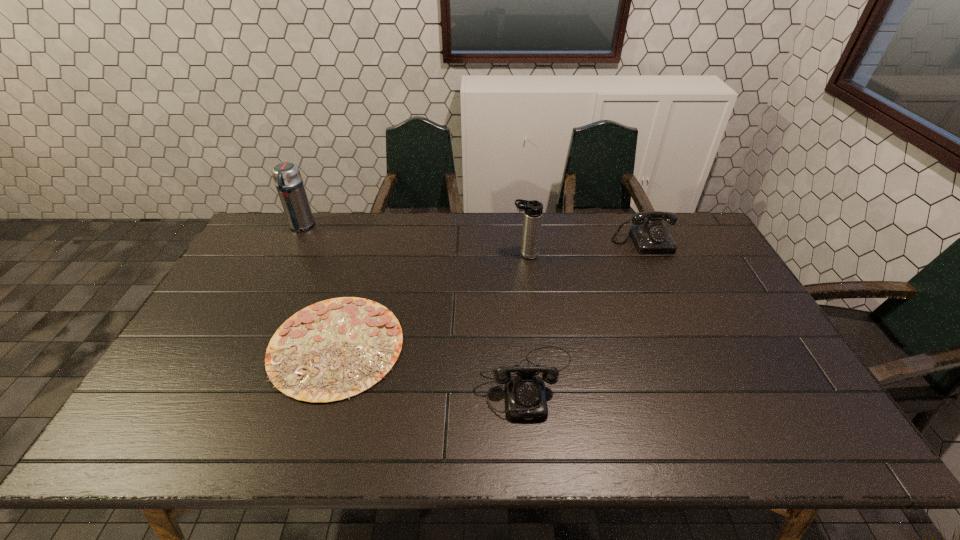
Where is `blank space located on the handle side of the right thermos bottle`? The width and height of the screenshot is (960, 540). blank space located on the handle side of the right thermos bottle is located at coordinates (488, 254).

You are a GUI agent. You are given a task and a screenshot of the screen. Output one action in this format:
    pyautogui.click(x=<x>, y=<y>)
    Task: Click on the vacant space located on the handle side of the right thermos bottle
    The height and width of the screenshot is (540, 960).
    Given the screenshot: What is the action you would take?
    pyautogui.click(x=401, y=254)

This screenshot has height=540, width=960. I want to click on vacant position located 0.370m on the dial of the rightmost object, so click(x=686, y=340).

Find the location of a particular element. The width and height of the screenshot is (960, 540). vacant area situated 0.060m on the back of the shortest object is located at coordinates (355, 286).

The width and height of the screenshot is (960, 540). In order to click on telephone that is at the far edge in this screenshot , I will do `click(650, 236)`.

The width and height of the screenshot is (960, 540). What are the coordinates of `object located in the near edge section of the desktop` in the screenshot? It's located at (526, 396).

This screenshot has height=540, width=960. Find the location of `object at the left edge`. object at the left edge is located at coordinates (286, 175).

The image size is (960, 540). What are the coordinates of `object located at the right edge` in the screenshot? It's located at (650, 236).

Locate an element on the screen. This screenshot has height=540, width=960. object present at the far left corner is located at coordinates (286, 175).

The image size is (960, 540). I want to click on object present at the far right corner, so click(650, 236).